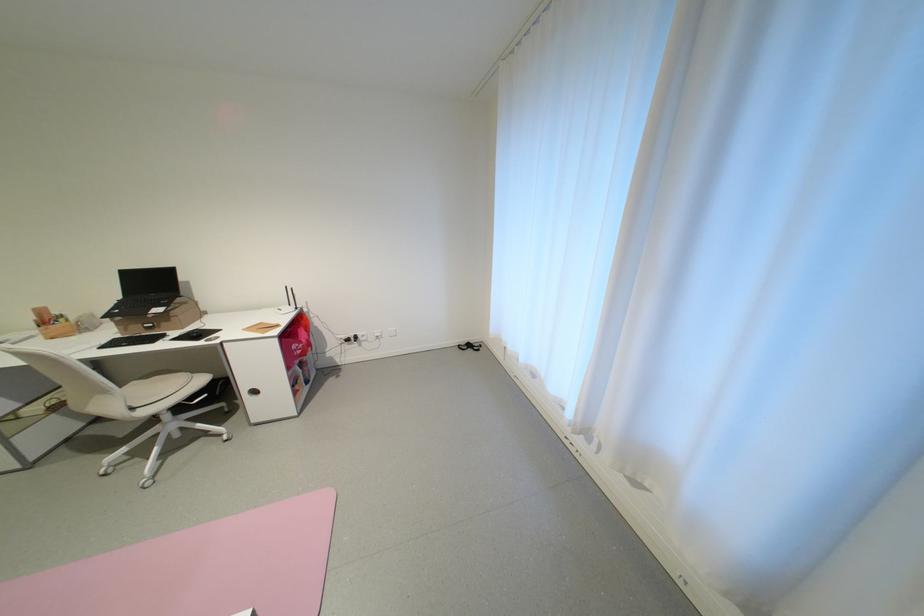
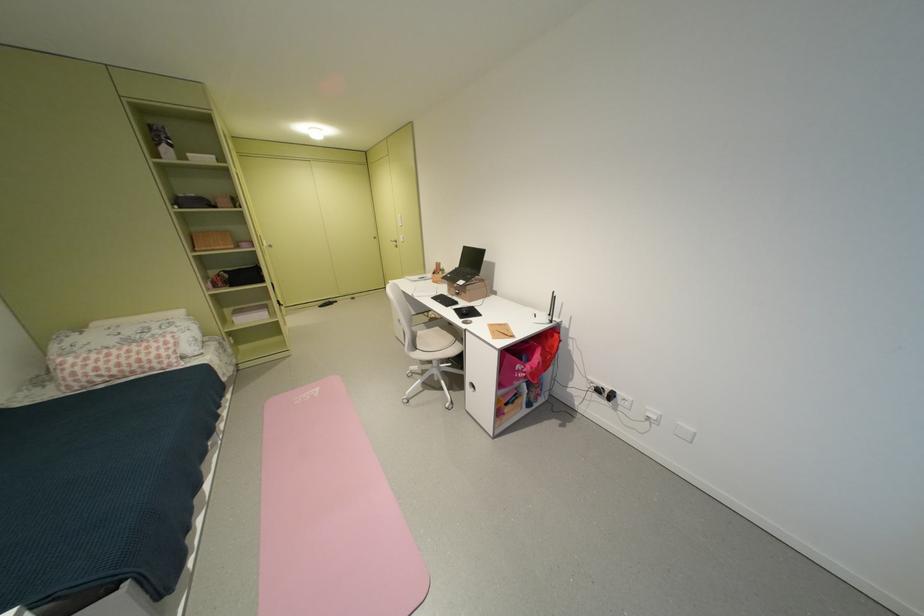
Find the pixel in the second image that matches (358,341) in the first image.

(609, 392)